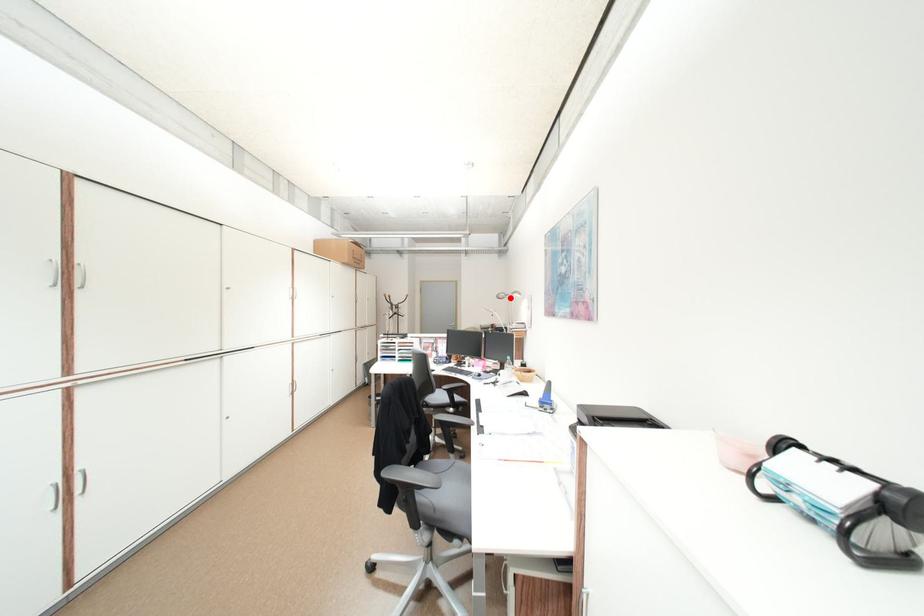
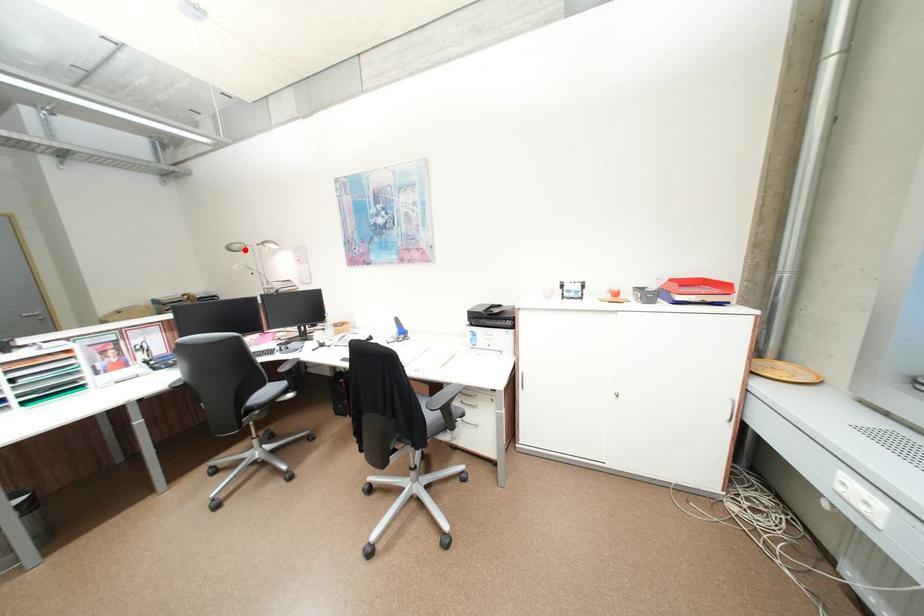
I am providing you with two images of the same scene from different viewpoints. A red point is marked on the first image and another point is marked on the second image. Is the red point in image1 aligned with the point shown in image2?

Yes